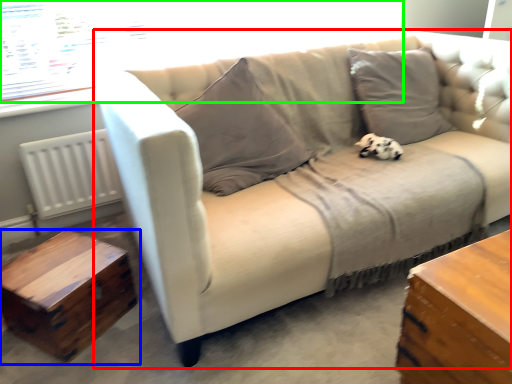
Question: Estimate the real-world distances between objects in this image. Which object is closer to studio couch (highlighted by a red box), table (highlighted by a blue box) or window screen (highlighted by a green box)?

Choices:
 (A) table
 (B) window screen

Answer: (A)